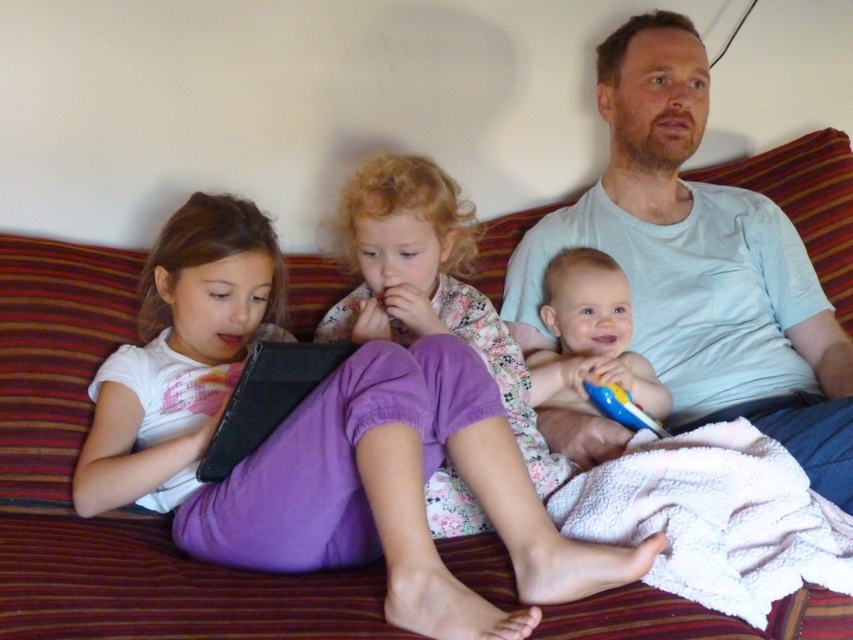
Question: Can you confirm if smooth plastic toy at center is positioned below yellow plastic spoon at right?

Choices:
 (A) no
 (B) yes

Answer: (A)

Question: Is light blue t-shirt at upper right in front of smooth plastic toy at center?

Choices:
 (A) yes
 (B) no

Answer: (A)

Question: Is floral fabric dress at center to the right of yellow plastic spoon at right from the viewer's perspective?

Choices:
 (A) no
 (B) yes

Answer: (A)

Question: Which of the following is the farthest from the observer?

Choices:
 (A) (447, 230)
 (B) (292, 548)
 (C) (659, 426)

Answer: (A)

Question: Which of the following is the closest to the observer?

Choices:
 (A) floral fabric dress at center
 (B) light blue t-shirt at upper right
 (C) purple cotton pants at lower left
 (D) yellow plastic spoon at right

Answer: (C)

Question: Among these objects, which one is farthest from the camera?

Choices:
 (A) floral fabric dress at center
 (B) purple cotton pants at lower left
 (C) light blue t-shirt at upper right
 (D) yellow plastic spoon at right

Answer: (D)